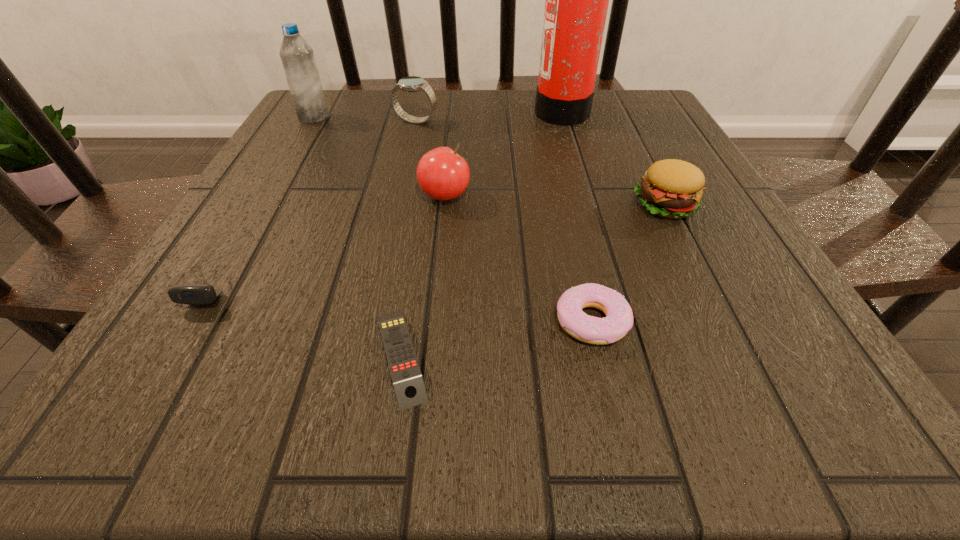
This screenshot has height=540, width=960. I want to click on vacant area situated on the front side of the tallest object, so click(384, 111).

You are a GUI agent. You are given a task and a screenshot of the screen. Output one action in this format:
    pyautogui.click(x=<x>, y=<y>)
    Task: Click on the free location located on the front side of the tallest object
    
    Given the screenshot: What is the action you would take?
    pyautogui.click(x=451, y=111)

This screenshot has height=540, width=960. I want to click on vacant point located on the right of the water bottle, so click(389, 117).

At what (x,y) coordinates should I click in order to perform the action: click on vacant area situated on the front of the watch. Please return your answer as a coordinate pair (x, y). This screenshot has width=960, height=540. Looking at the image, I should click on (398, 197).

Where is `blank space located on the left of the apple`? The height and width of the screenshot is (540, 960). blank space located on the left of the apple is located at coordinates (271, 196).

Where is `vacant space located 0.390m on the back of the fourth shortest object`? Image resolution: width=960 pixels, height=540 pixels. vacant space located 0.390m on the back of the fourth shortest object is located at coordinates (612, 99).

The width and height of the screenshot is (960, 540). Find the location of `vacant space situated 0.070m on the front-facing side of the webcam`. vacant space situated 0.070m on the front-facing side of the webcam is located at coordinates (167, 354).

Find the location of `free location located 0.060m on the front of the seventh tallest object`. free location located 0.060m on the front of the seventh tallest object is located at coordinates (608, 392).

The image size is (960, 540). What are the coordinates of `free spot located on the back of the remote control` in the screenshot? It's located at (422, 214).

Where is `fire extinguisher that is positioned at the far edge`? The height and width of the screenshot is (540, 960). fire extinguisher that is positioned at the far edge is located at coordinates (576, 0).